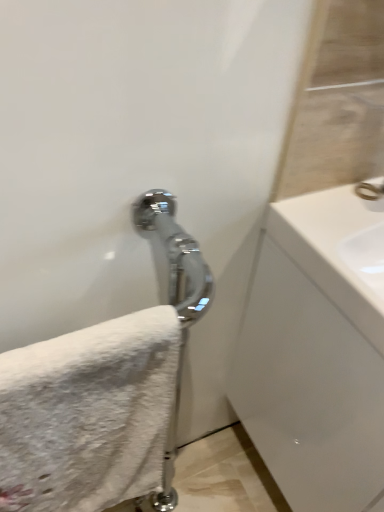
Question: From the image's perspective, is white glossy sink at right located above or below white fluffy towel at lower left?

Choices:
 (A) above
 (B) below

Answer: (A)

Question: Considering the positions of white glossy sink at right and white fluffy towel at lower left in the image, is white glossy sink at right taller or shorter than white fluffy towel at lower left?

Choices:
 (A) short
 (B) tall

Answer: (B)

Question: Which of these objects is positioned farthest from the white glossy sink at right?

Choices:
 (A) polished chrome faucet at upper right
 (B) white fluffy towel at lower left

Answer: (B)

Question: Which object is the closest to the polished chrome faucet at upper right?

Choices:
 (A) white fluffy towel at lower left
 (B) white glossy sink at right

Answer: (B)